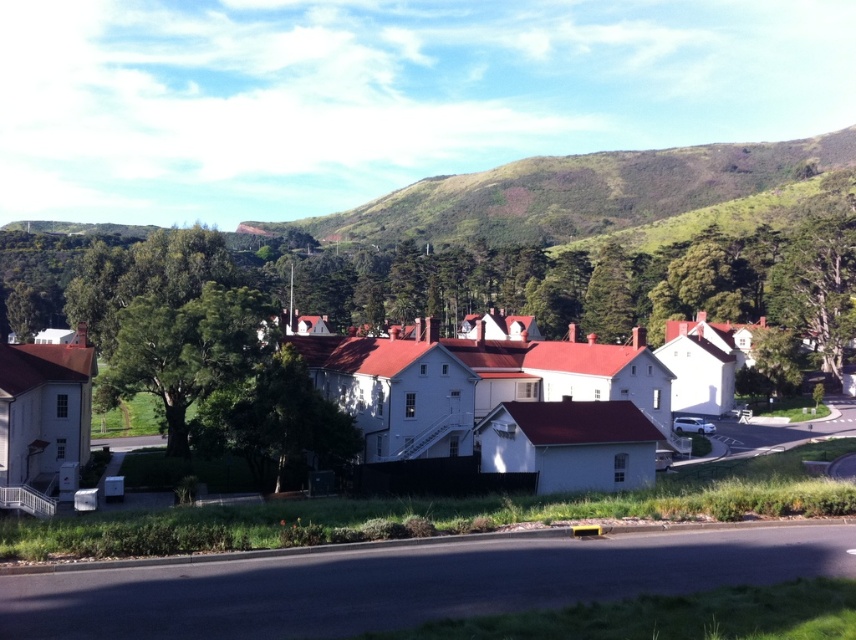
Question: Is green leafy tree at center-left above green leafy tree at center?

Choices:
 (A) no
 (B) yes

Answer: (B)

Question: Which point appears farthest from the camera in this image?

Choices:
 (A) (504, 180)
 (B) (801, 228)
 (C) (247, 445)

Answer: (A)

Question: Does green leafy tree at center-left appear under green textured tree at right?

Choices:
 (A) no
 (B) yes

Answer: (B)

Question: Which point appears farthest from the camera in this image?

Choices:
 (A) coord(233,426)
 (B) coord(609,168)
 (C) coord(837,342)

Answer: (B)

Question: Which of the following is the closest to the observer?

Choices:
 (A) green leafy tree at center
 (B) green grassy hillside at upper center
 (C) green leafy tree at center-left
 (D) green textured tree at right

Answer: (A)

Question: Is green leafy tree at center-left smaller than green leafy tree at center?

Choices:
 (A) no
 (B) yes

Answer: (A)